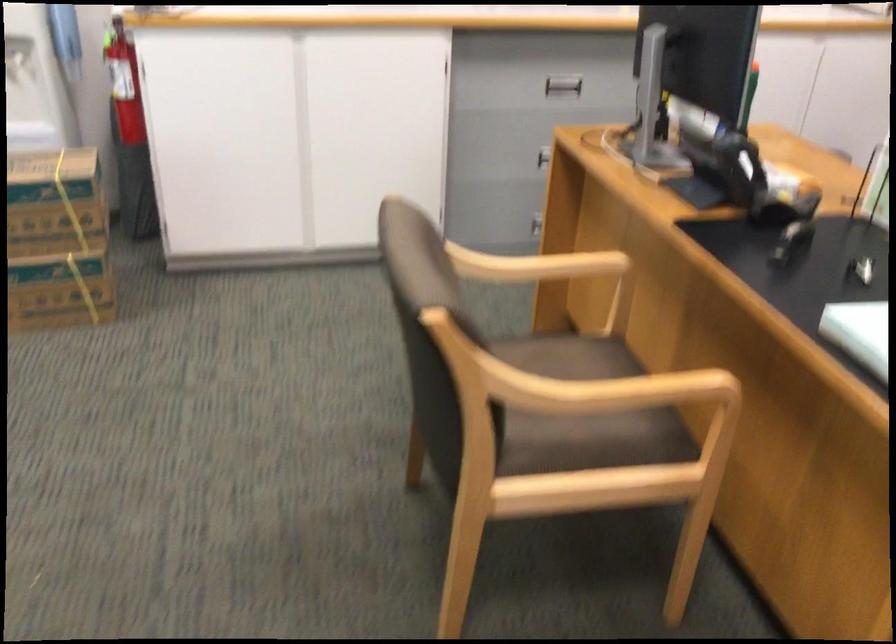
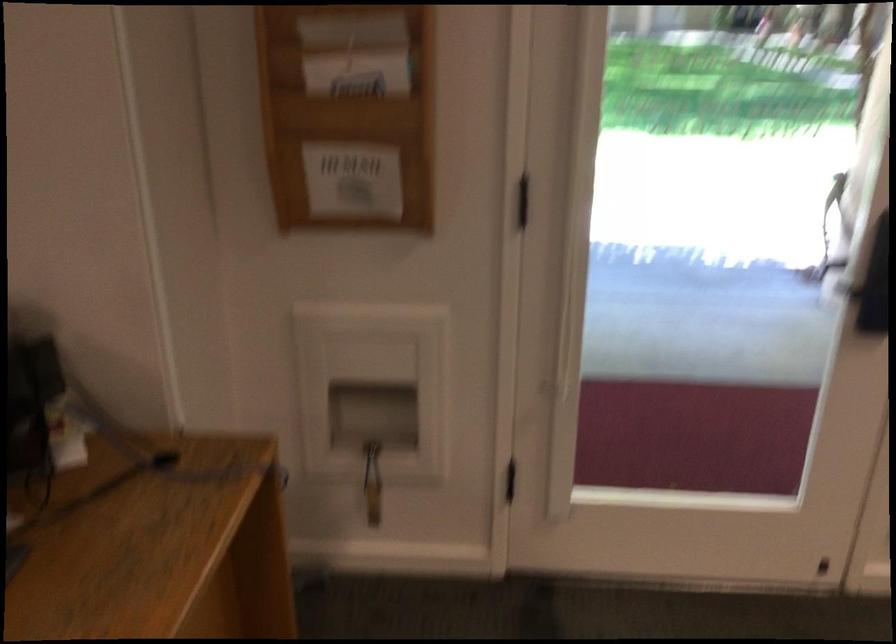
How did the camera likely rotate?

The rotation direction of the camera is left-down.